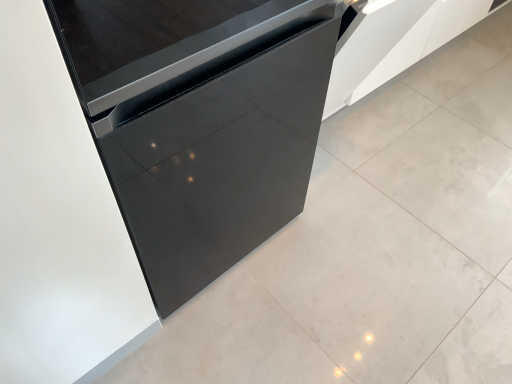
Where is `free region under matte black dishwasher at center (from a real-world perspective)`? The width and height of the screenshot is (512, 384). free region under matte black dishwasher at center (from a real-world perspective) is located at coordinates (192, 212).